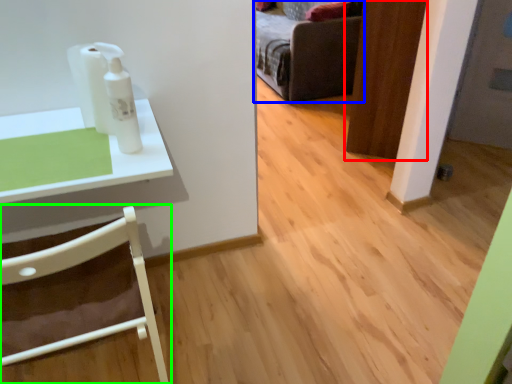
Question: Which object is positioned closest to door (highlighted by a red box)? Select from furniture (highlighted by a blue box) and chair (highlighted by a green box).

Choices:
 (A) furniture
 (B) chair

Answer: (A)